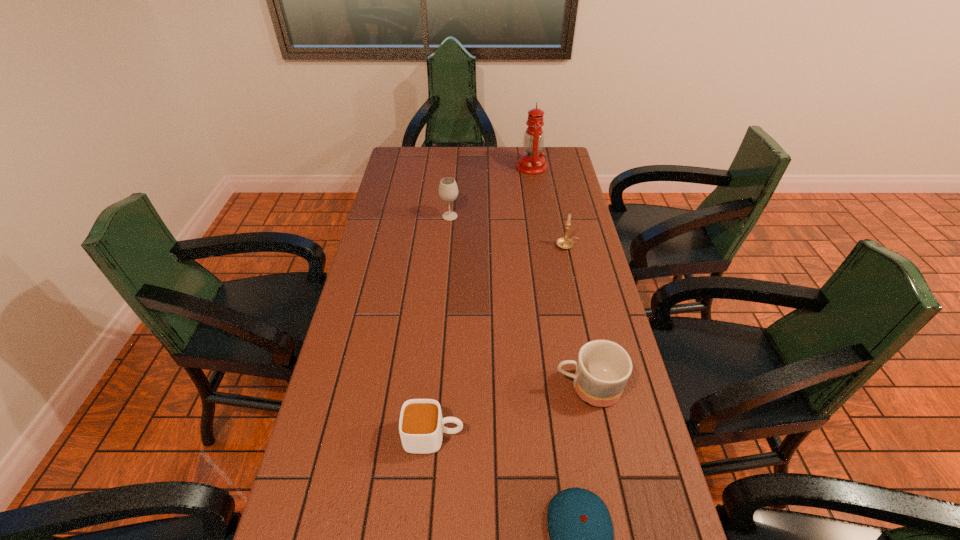
In order to click on vacant area that lies between the fourth tallest object and the tallest object in this screenshot , I will do `click(560, 277)`.

Select which object is the fourth closest to the baseball cap. Please provide its 2D coordinates. Your answer should be formatted as a tuple, i.e. [(x, y)], where the tuple contains the x and y coordinates of a point satisfying the conditions above.

[(448, 191)]

I want to click on object that is the nearest to the wineglass, so click(x=531, y=162).